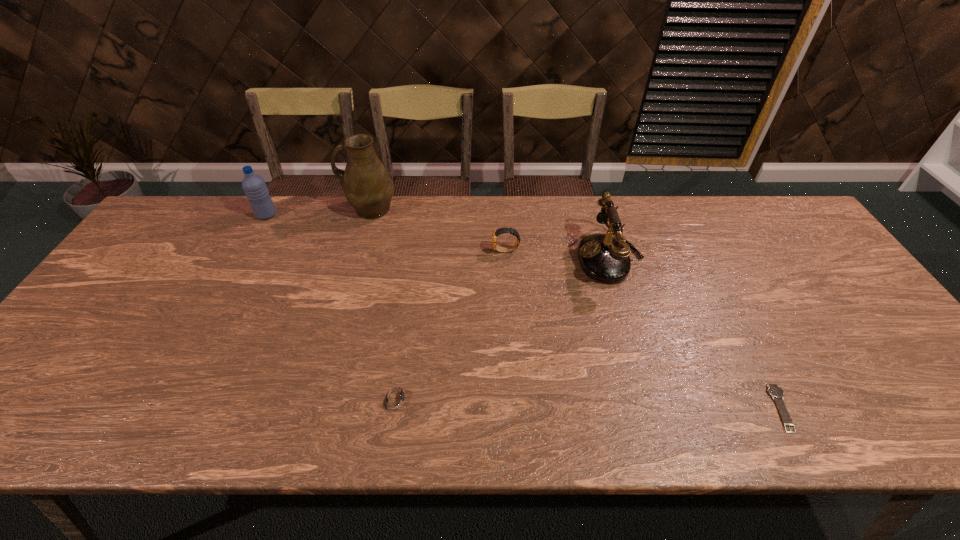
Identify the location of free space between the water bottle and the shortest watch. The image size is (960, 540). (524, 312).

Where is `vacant space in between the telephone and the farthest watch`? The height and width of the screenshot is (540, 960). vacant space in between the telephone and the farthest watch is located at coordinates (558, 254).

Identify the location of the third closest object to the telephone. tap(394, 398).

I want to click on the fifth closest object relative to the water bottle, so click(x=774, y=390).

Locate an element on the screen. watch that is the second nearest to the tallest watch is located at coordinates (774, 390).

The height and width of the screenshot is (540, 960). What are the coordinates of `watch that stands as the closest to the telephone` in the screenshot? It's located at (499, 231).

The height and width of the screenshot is (540, 960). What are the coordinates of `free space that satisfies the following two spatial constraints: 1. on the dial of the shortest watch; 2. on the left side of the fifth object from left to right` in the screenshot? It's located at pyautogui.click(x=655, y=408).

At what (x,y) coordinates should I click in order to perform the action: click on free location that satisfies the following two spatial constraints: 1. on the dial of the telephone; 2. on the right side of the shortest object. Please return your answer as a coordinate pair (x, y). This screenshot has width=960, height=540. Looking at the image, I should click on (655, 408).

The height and width of the screenshot is (540, 960). Find the location of `free space that satisfies the following two spatial constraints: 1. on the face of the shortest object; 2. on the left side of the second shortest watch`. free space that satisfies the following two spatial constraints: 1. on the face of the shortest object; 2. on the left side of the second shortest watch is located at coordinates (395, 408).

The width and height of the screenshot is (960, 540). I want to click on vacant space that satisfies the following two spatial constraints: 1. on the dial of the second object from right to left; 2. on the right side of the shortest object, so click(655, 408).